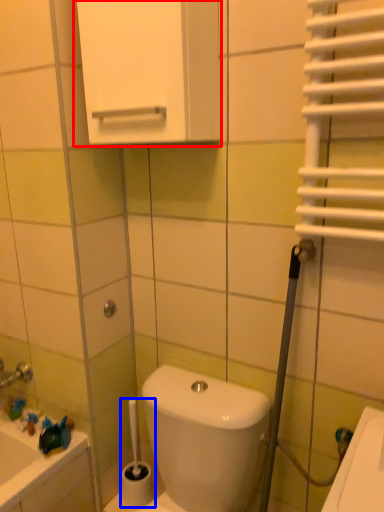
Question: Which object is further to the camera taking this photo, medicine cabinet (highlighted by a red box) or brush (highlighted by a blue box)?

Choices:
 (A) medicine cabinet
 (B) brush

Answer: (B)